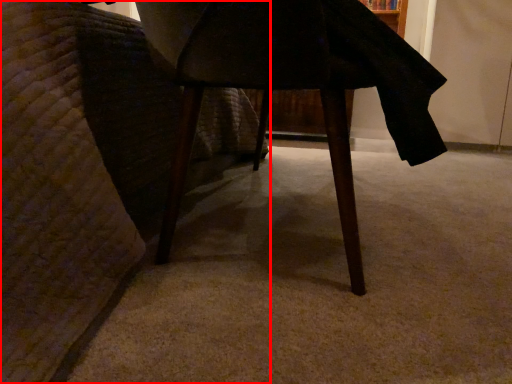
Question: From the image's perspective, where is furniture (annotated by the red box) located relative to table?

Choices:
 (A) below
 (B) above

Answer: (B)